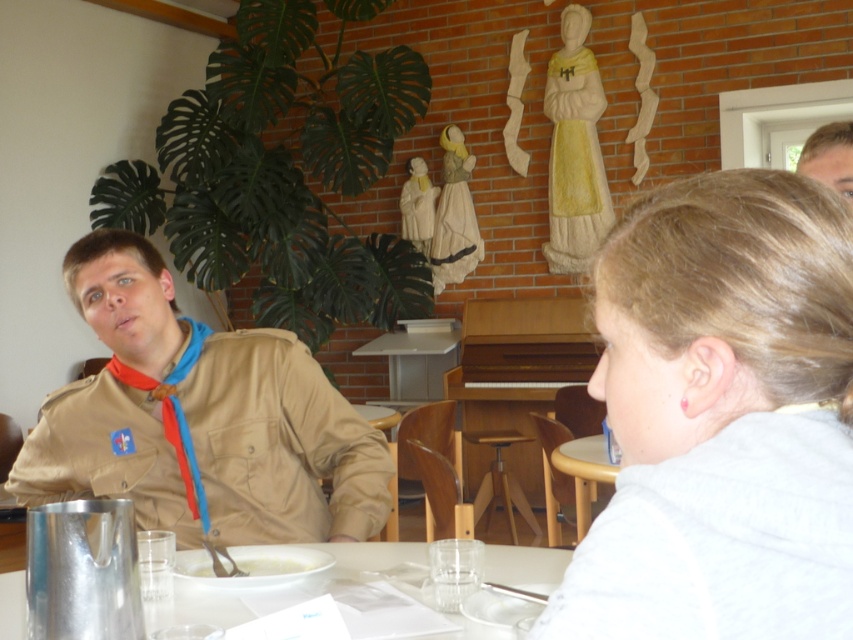
What are the coordinates of the clear plastic table at lower center?

The clear plastic table at lower center is located at coordinates point (524, 564).

Based on the photo, you are a photographer trying to capture a clear shot of the light brown hair at upper right and the white creamy soup at lower center. However, the light brown hair is blocking the view of the soup. Can you adjust your position to see both objects without any obstruction?

The light brown hair at upper right is in front of the white creamy soup at lower center, so moving your camera position slightly downward or to the side might allow you to capture both without obstruction.